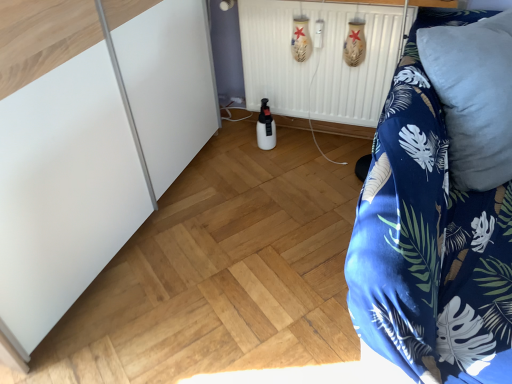
Question: Does blue floral fabric at right come in front of white matte radiator at center?

Choices:
 (A) no
 (B) yes

Answer: (B)

Question: From a real-world perspective, is blue floral fabric at right physically below white matte radiator at center?

Choices:
 (A) yes
 (B) no

Answer: (A)

Question: Could you tell me if blue floral fabric at right is facing white matte radiator at center?

Choices:
 (A) yes
 (B) no

Answer: (B)

Question: Considering the relative sizes of blue floral fabric at right and white matte radiator at center in the image provided, is blue floral fabric at right thinner than white matte radiator at center?

Choices:
 (A) yes
 (B) no

Answer: (B)

Question: Is blue floral fabric at right taller than white matte radiator at center?

Choices:
 (A) no
 (B) yes

Answer: (B)

Question: Would you say white matte bottle at center is to the left or to the right of white matte radiator at center in the picture?

Choices:
 (A) left
 (B) right

Answer: (A)

Question: Looking at their shapes, would you say white matte bottle at center is wider or thinner than white matte radiator at center?

Choices:
 (A) thin
 (B) wide

Answer: (A)

Question: Looking at the image, does white matte bottle at center seem bigger or smaller compared to white matte radiator at center?

Choices:
 (A) small
 (B) big

Answer: (A)

Question: Considering the positions of point (261, 107) and point (342, 67), is point (261, 107) closer or farther from the camera than point (342, 67)?

Choices:
 (A) farther
 (B) closer

Answer: (A)

Question: Does point (454, 59) appear closer or farther from the camera than point (498, 266)?

Choices:
 (A) closer
 (B) farther

Answer: (B)

Question: From a real-world perspective, relative to blue floral fabric at right, is blue soft pillow at right vertically above or below?

Choices:
 (A) above
 (B) below

Answer: (A)

Question: In terms of size, does blue soft pillow at right appear bigger or smaller than blue floral fabric at right?

Choices:
 (A) small
 (B) big

Answer: (A)

Question: Choose the correct answer: Is blue soft pillow at right inside blue floral fabric at right or outside it?

Choices:
 (A) outside
 (B) inside

Answer: (B)

Question: In terms of size, does blue soft pillow at right appear bigger or smaller than white matte bottle at center?

Choices:
 (A) small
 (B) big

Answer: (B)

Question: Looking at their shapes, would you say blue soft pillow at right is wider or thinner than white matte bottle at center?

Choices:
 (A) thin
 (B) wide

Answer: (B)